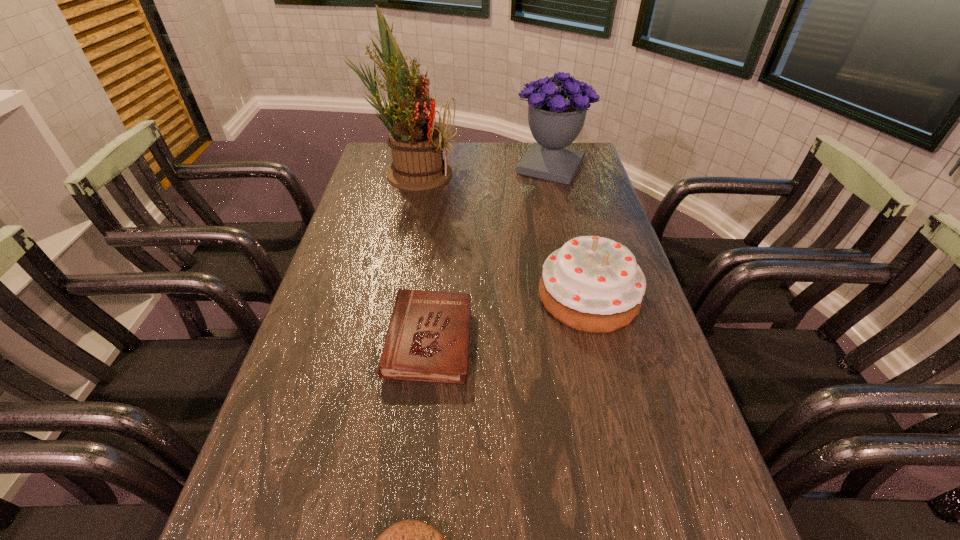
This screenshot has height=540, width=960. I want to click on vacant space that satisfies the following two spatial constraints: 1. on the back side of the third tallest object; 2. on the right side of the second shortest object, so click(x=434, y=296).